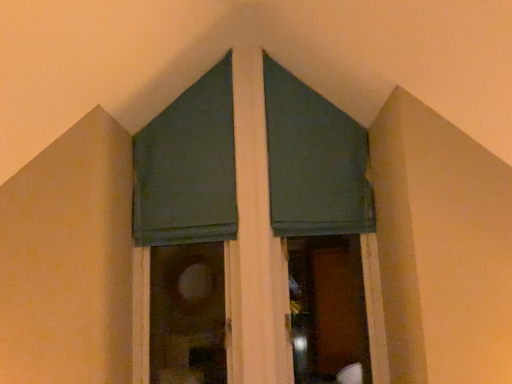
Question: Do you think green fabric at center is within green fabric window screen at upper center, or outside of it?

Choices:
 (A) outside
 (B) inside

Answer: (A)

Question: Would you say green fabric at center is to the left or to the right of green fabric window screen at upper center in the picture?

Choices:
 (A) right
 (B) left

Answer: (A)

Question: In the image, is green fabric at center positioned in front of or behind green fabric window screen at upper center?

Choices:
 (A) front
 (B) behind

Answer: (A)

Question: From a real-world perspective, is green fabric window screen at upper center physically located above or below green fabric at center?

Choices:
 (A) below
 (B) above

Answer: (B)

Question: From the image's perspective, is green fabric window screen at upper center located above or below green fabric at center?

Choices:
 (A) below
 (B) above

Answer: (B)

Question: Is green fabric window screen at upper center spatially inside green fabric at center, or outside of it?

Choices:
 (A) outside
 (B) inside

Answer: (B)

Question: Considering the positions of green fabric window screen at upper center and green fabric at center in the image, is green fabric window screen at upper center taller or shorter than green fabric at center?

Choices:
 (A) tall
 (B) short

Answer: (B)